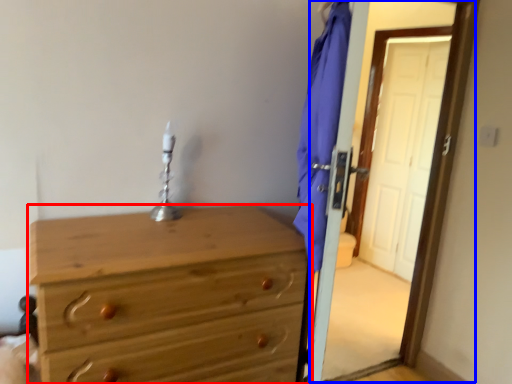
Question: Which point is further to the camera, chest of drawers (highlighted by a red box) or screen door (highlighted by a blue box)?

Choices:
 (A) chest of drawers
 (B) screen door

Answer: (B)